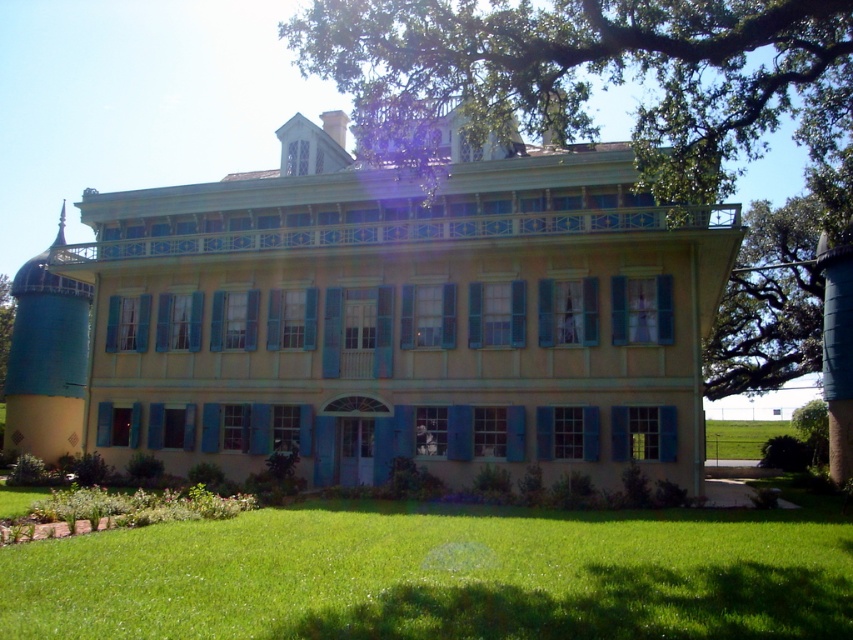
Question: From the image, what is the correct spatial relationship of green leafy tree at upper center in relation to green leafy tree at lower left?

Choices:
 (A) below
 (B) above

Answer: (B)

Question: Which object is positioned closest to the green leafy tree at upper right?

Choices:
 (A) green leafy tree at lower left
 (B) green grass at lower right
 (C) green leafy tree at upper center
 (D) green grass at lower center

Answer: (C)

Question: Which point is farther to the camera?

Choices:
 (A) (306, 534)
 (B) (752, 422)
 (C) (759, 227)
 (D) (0, 387)

Answer: (B)

Question: Is green leafy tree at upper center positioned at the back of green leafy tree at lower left?

Choices:
 (A) no
 (B) yes

Answer: (A)

Question: Which object is the farthest from the green leafy tree at lower left?

Choices:
 (A) green leafy tree at upper right
 (B) green grass at lower center
 (C) green leafy tree at upper center
 (D) green grass at lower right

Answer: (D)

Question: Is green leafy tree at upper center thinner than green leafy tree at lower left?

Choices:
 (A) yes
 (B) no

Answer: (B)